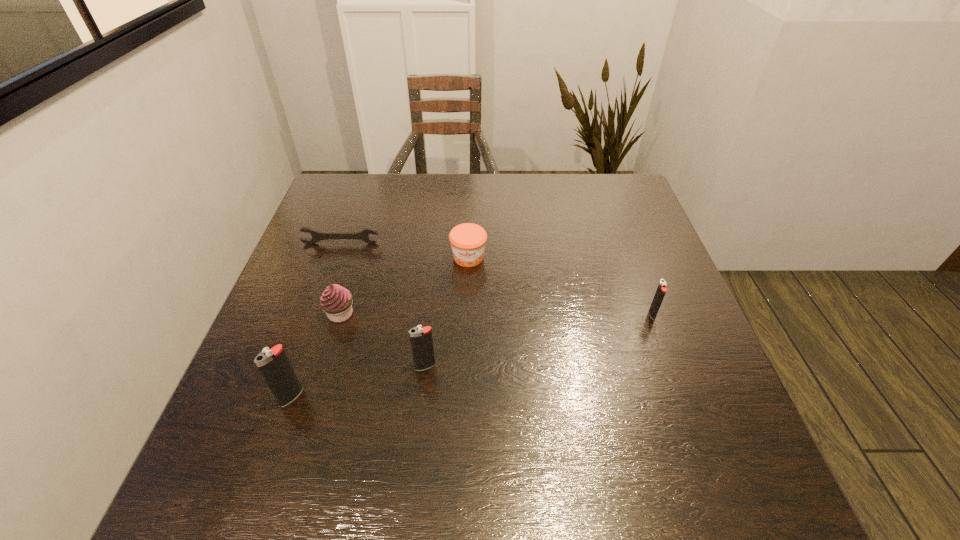
At what (x,y) coordinates should I click in order to perform the action: click on cupcake that is positioned at the left edge. Please return your answer as a coordinate pair (x, y). Looking at the image, I should click on (336, 301).

You are a GUI agent. You are given a task and a screenshot of the screen. Output one action in this format:
    pyautogui.click(x=<x>, y=<y>)
    Task: Click on the object that is at the right edge
    Image resolution: width=960 pixels, height=540 pixels.
    Given the screenshot: What is the action you would take?
    pyautogui.click(x=661, y=290)

Identify the location of object at the near left corner. (274, 365).

Find the location of `free space at the far edge`. free space at the far edge is located at coordinates (492, 194).

Where is `free region at the near edge`? free region at the near edge is located at coordinates coord(512,429).

This screenshot has width=960, height=540. In the image, there is a desktop. Identify the location of vacant space at the left edge. (300, 259).

This screenshot has width=960, height=540. I want to click on vacant position at the right edge of the desktop, so click(650, 285).

In order to click on vacant region at the near left corner in this screenshot , I will do `click(282, 441)`.

Locate an element on the screen. Image resolution: width=960 pixels, height=540 pixels. free spot between the nearest object and the second farthest object is located at coordinates (380, 327).

Find the location of a particular element. Image resolution: width=960 pixels, height=540 pixels. free spot between the shortest igniter and the tallest igniter is located at coordinates (471, 355).